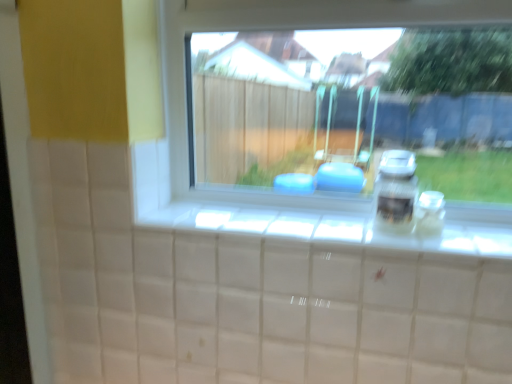
What do you see at coordinates (430, 213) in the screenshot?
I see `transparent glass jar at right` at bounding box center [430, 213].

Where is `satin silver jar at right`? satin silver jar at right is located at coordinates (396, 191).

Image resolution: width=512 pixels, height=384 pixels. Find the location of `transparent glass window at center`. transparent glass window at center is located at coordinates (250, 28).

Image resolution: width=512 pixels, height=384 pixels. What are the coordinates of `glass jar behind the transparent glass window at center` in the screenshot? It's located at (430, 213).

How far apart are transparent glass window at center and transparent glass jar at right?

The distance of transparent glass window at center from transparent glass jar at right is 14.52 inches.

Is transparent glass window at center positioned with its back to transparent glass jar at right?

Yes, transparent glass window at center is positioned with its back facing transparent glass jar at right.

Between transparent glass window at center and transparent glass jar at right, which one appears on the left side from the viewer's perspective?

transparent glass window at center is more to the left.

Is satin silver jar at right inside or outside of transparent glass jar at right?

satin silver jar at right lies outside transparent glass jar at right.

Is satin silver jar at right positioned before transparent glass jar at right?

Yes.

Can you confirm if satin silver jar at right is smaller than transparent glass jar at right?

No.

Could you tell me if satin silver jar at right is turned towards transparent glass jar at right?

No, satin silver jar at right is not facing towards transparent glass jar at right.

Is transparent glass jar at right far from transparent glass window at center?

No, transparent glass jar at right is in close proximity to transparent glass window at center.

In the scene shown: Which is further, (428,222) or (426,22)?

The point (426,22) is more distant.

From a real-world perspective, is transparent glass jar at right above or below transparent glass window at center?

transparent glass jar at right is situated lower than transparent glass window at center in the real world.

What's the angular difference between transparent glass jar at right and transparent glass window at center's facing directions?

transparent glass jar at right and transparent glass window at center are facing 0.183 degrees away from each other.

From a real-world perspective, between transparent glass jar at right and satin silver jar at right, who is vertically higher?

satin silver jar at right is physically above.

Does point (420, 212) appear closer or farther from the camera than point (387, 150)?

Clearly, point (420, 212) is closer to the camera than point (387, 150).

Which of these two, transparent glass jar at right or satin silver jar at right, is bigger?

satin silver jar at right.

Which object is positioned more to the left, transparent glass jar at right or satin silver jar at right?

Positioned to the left is satin silver jar at right.

Considering their positions, is transparent glass window at center located in front of or behind satin silver jar at right?

In the image, transparent glass window at center appears in front of satin silver jar at right.

Is satin silver jar at right at the back of transparent glass window at center?

Correct, transparent glass window at center is looking away from satin silver jar at right.

Based on the photo, what's the angular difference between transparent glass window at center and satin silver jar at right's facing directions?

0.184 degrees separate the facing orientations of transparent glass window at center and satin silver jar at right.

Is point (294, 6) farther from camera compared to point (383, 191)?

Yes, point (294, 6) is farther from viewer.

Does satin silver jar at right appear on the left side of transparent glass window at center?

Result: No.

Is satin silver jar at right inside the boundaries of transparent glass window at center, or outside?

satin silver jar at right cannot be found inside transparent glass window at center.

Is point (410, 210) less distant than point (170, 128)?

Yes, it is.

Is transparent glass window at center at the back of satin silver jar at right?

Yes, satin silver jar at right is positioned with its back facing transparent glass window at center.

Where is `glass jar that is behind the transparent glass window at center`? glass jar that is behind the transparent glass window at center is located at coordinates (430, 213).

The width and height of the screenshot is (512, 384). Find the location of `appliance that appears above the transparent glass jar at right (from the image's perspective)`. appliance that appears above the transparent glass jar at right (from the image's perspective) is located at coordinates (x=396, y=191).

Considering their positions, is satin silver jar at right positioned closer to transparent glass window at center than transparent glass jar at right?

satin silver jar at right.

When comparing their distances from transparent glass window at center, does transparent glass jar at right or satin silver jar at right seem further?

Among the two, transparent glass jar at right is located further to transparent glass window at center.

When comparing their distances from satin silver jar at right, does transparent glass jar at right or transparent glass window at center seem closer?

transparent glass jar at right is positioned closer to the anchor satin silver jar at right.

Based on their spatial positions, is transparent glass window at center or satin silver jar at right further from transparent glass jar at right?

Among the two, transparent glass window at center is located further to transparent glass jar at right.

From the picture: Estimate the real-world distances between objects in this image. Which object is further from transparent glass jar at right, satin silver jar at right or transparent glass window at center?

Among the two, transparent glass window at center is located further to transparent glass jar at right.

Considering their positions, is transparent glass window at center positioned further to satin silver jar at right than transparent glass jar at right?

transparent glass window at center.

The width and height of the screenshot is (512, 384). I want to click on appliance between transparent glass window at center and transparent glass jar at right in the vertical direction, so click(x=396, y=191).